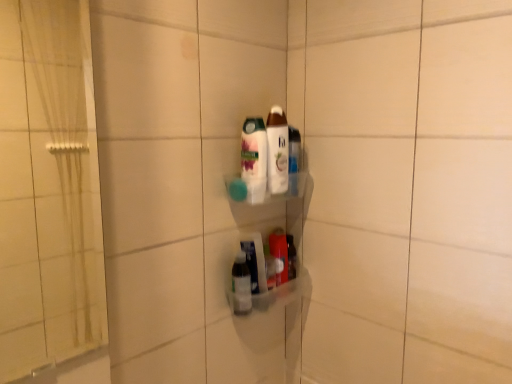
Question: From a real-world perspective, is white glossy lotion at center, the 4th bottle when ordered from bottom to top, physically located above or below white glossy bottle at center, arranged as the second bottle when viewed from the top?

Choices:
 (A) below
 (B) above

Answer: (B)

Question: Looking at their shapes, would you say white glossy lotion at center, the 4th bottle when ordered from bottom to top, is wider or thinner than white glossy bottle at center, arranged as the second bottle when viewed from the top?

Choices:
 (A) wide
 (B) thin

Answer: (B)

Question: Estimate the real-world distances between objects in this image. Which object is closer to the white glossy lotion at center, the 4th bottle when ordered from bottom to top?

Choices:
 (A) white glossy bottle at center, positioned as the third bottle in bottom-to-top order
 (B) translucent plastic bottle at lower center, which appears as the 2th bottle when ordered from the bottom
 (C) translucent plastic bottle at center, the first bottle in the bottom-to-top sequence

Answer: (A)

Question: Estimate the real-world distances between objects in this image. Which object is farther from the translucent plastic bottle at center, which ranks as the 4th bottle in top-to-bottom order?

Choices:
 (A) white glossy bottle at center, positioned as the third bottle in bottom-to-top order
 (B) translucent plastic bottle at lower center, which appears as the 2th bottle when ordered from the bottom
 (C) white glossy lotion at center, arranged as the 1th bottle when viewed from the top

Answer: (C)